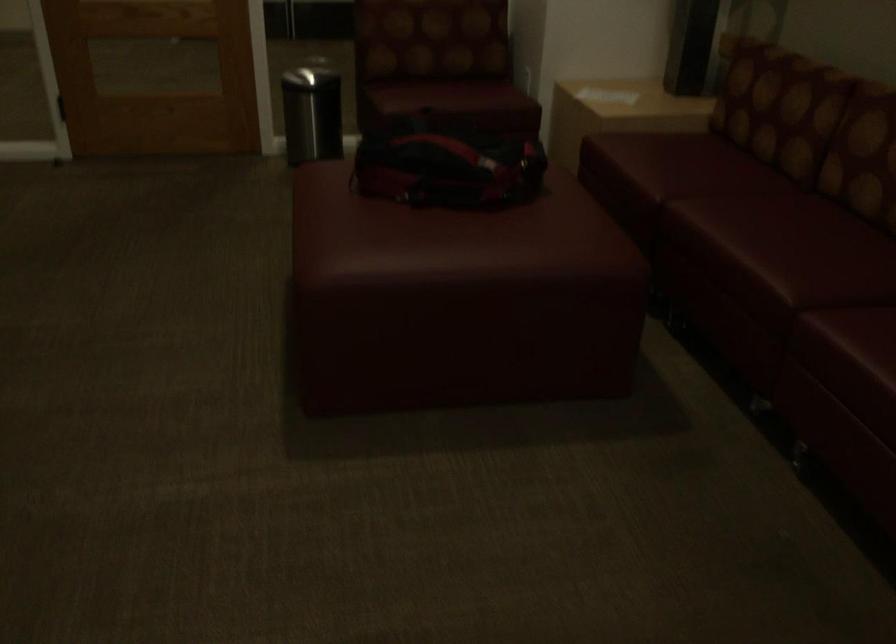
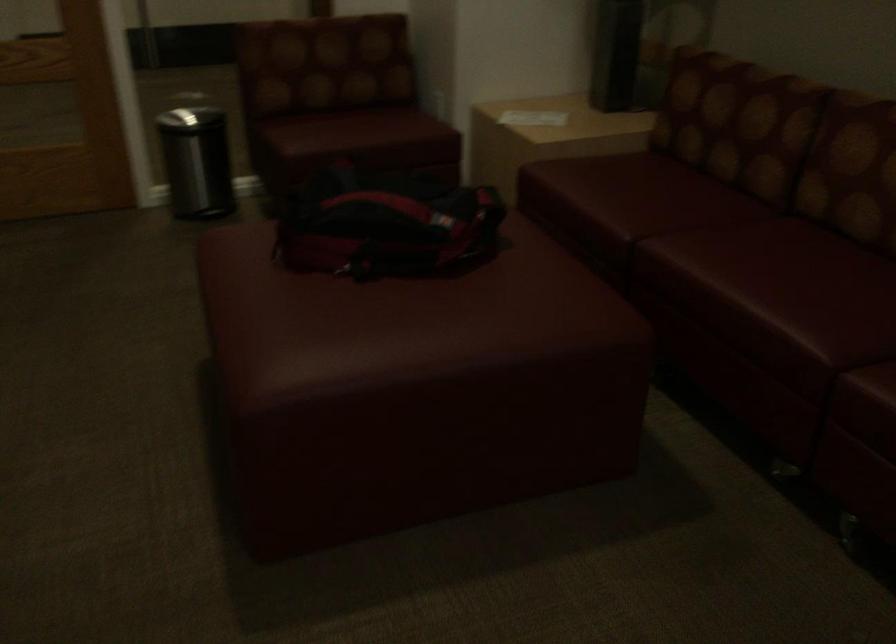
Question: The first image is from the beginning of the video and the second image is from the end. How did the camera likely rotate when shooting the video?

Choices:
 (A) Left
 (B) Right
 (C) Up
 (D) Down

Answer: (B)